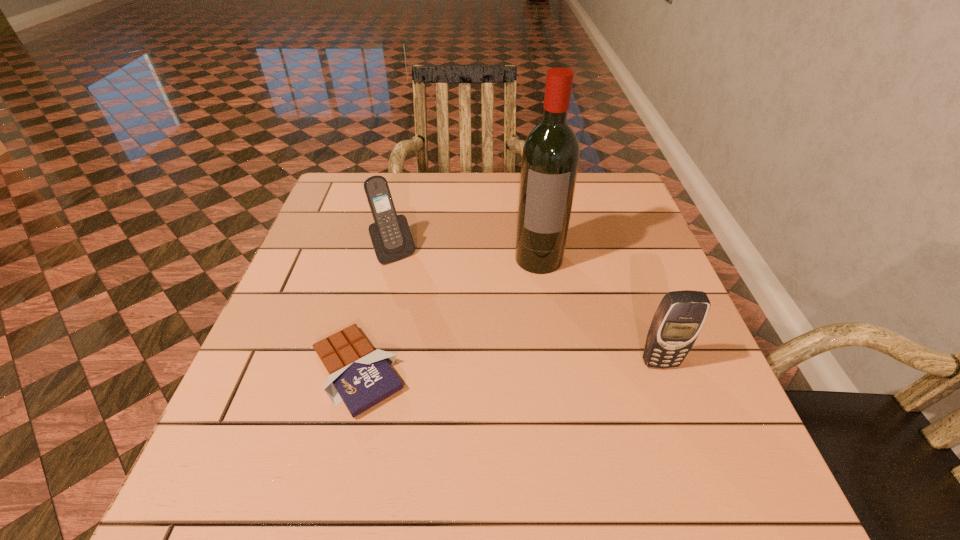
You are a GUI agent. You are given a task and a screenshot of the screen. Output one action in this format:
    pyautogui.click(x=<x>, y=<y>)
    Task: Click on the vacant area that lies between the farther cellular telephone and the tallest object
    The width and height of the screenshot is (960, 540).
    Given the screenshot: What is the action you would take?
    pyautogui.click(x=467, y=255)

I want to click on free space that is in between the nearer cellular telephone and the wine bottle, so click(x=599, y=310).

I want to click on empty location between the second object from right to left and the shortest object, so click(x=448, y=314).

Where is `unoccupied position between the second object from right to left and the farther cellular telephone`? unoccupied position between the second object from right to left and the farther cellular telephone is located at coordinates (467, 255).

This screenshot has width=960, height=540. Find the location of `the closest object to the chocolate bar`. the closest object to the chocolate bar is located at coordinates (391, 238).

Identify the location of object that can be found as the second closest to the third object from left to right. (680, 316).